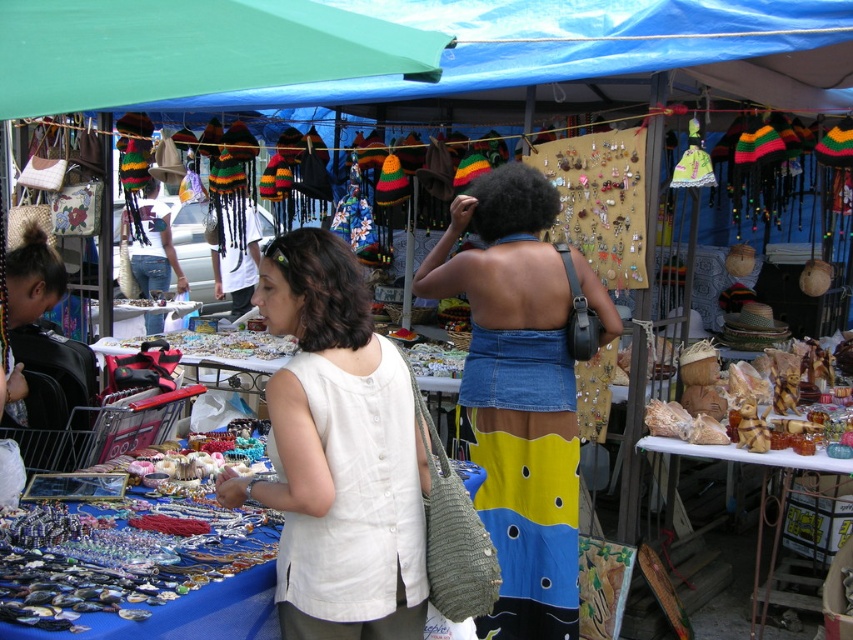
Question: Considering the real-world distances, which object is farthest from the denim skirt at center?

Choices:
 (A) green fabric canopy at upper left
 (B) white linen blouse at center

Answer: (A)

Question: Which point is farther from the camera taking this photo?

Choices:
 (A) (286, 428)
 (B) (181, 67)
 (C) (503, 294)

Answer: (C)

Question: Is white linen blouse at center above denim skirt at center?

Choices:
 (A) yes
 (B) no

Answer: (B)

Question: Does denim skirt at center have a smaller size compared to green fabric canopy at upper left?

Choices:
 (A) no
 (B) yes

Answer: (A)

Question: Which point is farther from the camera taking this photo?

Choices:
 (A) (164, 24)
 (B) (352, 477)

Answer: (B)

Question: Is denim skirt at center bigger than green fabric canopy at upper left?

Choices:
 (A) yes
 (B) no

Answer: (A)